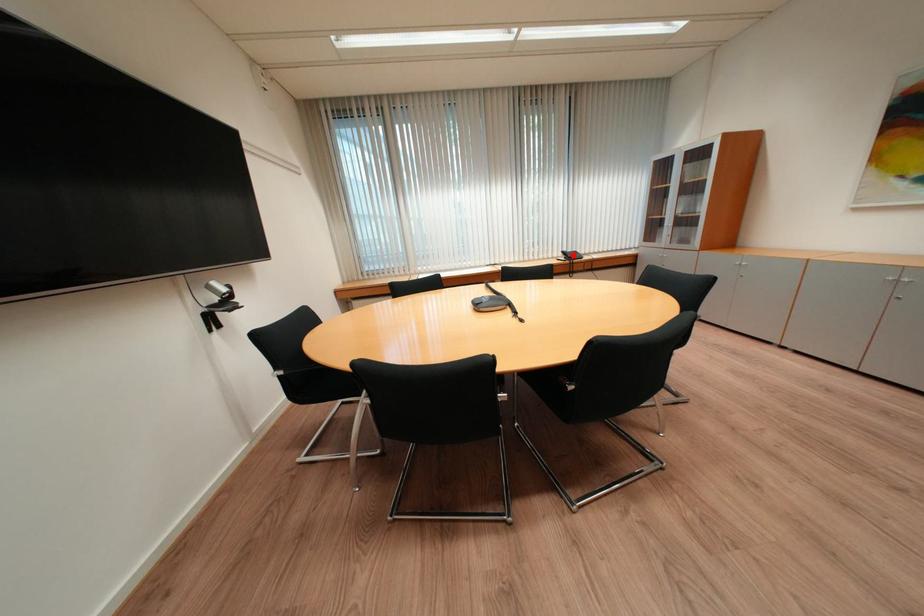
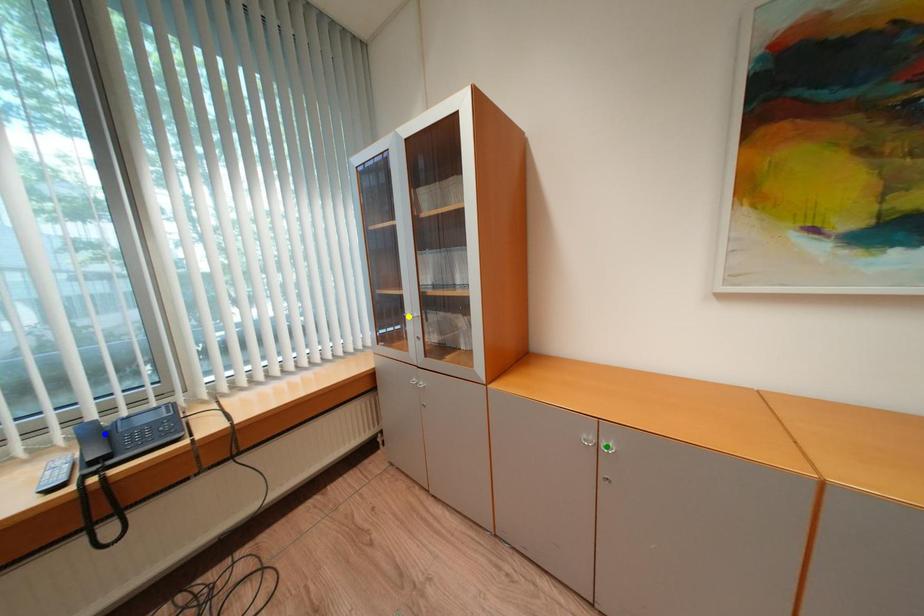
Question: I am providing you with two images of the same scene from different viewpoints. A red point is marked on the first image. You are given multiple points on the second image. Which point in image 2 is actually the same real-world point as the red point in image 1?

Choices:
 (A) green point
 (B) yellow point
 (C) blue point

Answer: (C)